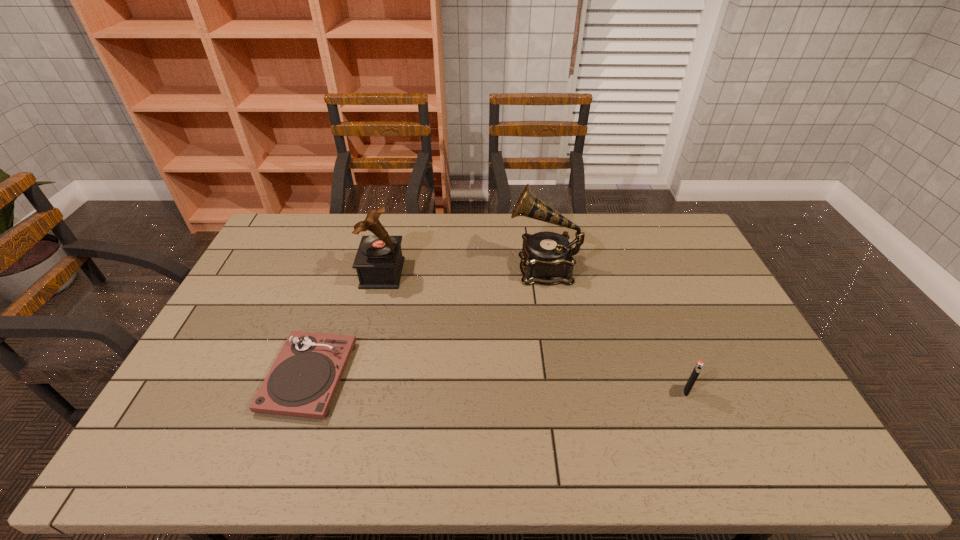
In order to click on vacant space in between the rightmost phonograph_record and the igniter in this screenshot , I will do `click(615, 329)`.

Select which object is the third closest to the third object from left to right. Please provide its 2D coordinates. Your answer should be formatted as a tuple, i.e. [(x, y)], where the tuple contains the x and y coordinates of a point satisfying the conditions above.

[(302, 382)]

Select which object appears as the second closest to the rightmost phonograph_record. Please provide its 2D coordinates. Your answer should be formatted as a tuple, i.e. [(x, y)], where the tuple contains the x and y coordinates of a point satisfying the conditions above.

[(696, 371)]

Image resolution: width=960 pixels, height=540 pixels. Find the location of `phonograph_record identified as the closest to the rightmost phonograph_record`. phonograph_record identified as the closest to the rightmost phonograph_record is located at coordinates (379, 262).

Locate which phonograph_record is the second closest to the shortest phonograph_record. Please provide its 2D coordinates. Your answer should be formatted as a tuple, i.e. [(x, y)], where the tuple contains the x and y coordinates of a point satisfying the conditions above.

[(546, 258)]

Find the location of a particular element. Image resolution: width=960 pixels, height=540 pixels. free location that satisfies the following two spatial constraints: 1. on the horn of the third object from left to right; 2. on the front side of the shortest object is located at coordinates (561, 376).

Where is `vacant space that satisfies the following two spatial constraints: 1. on the horn of the rightmost phonograph_record; 2. on the left side of the third tallest object`? The image size is (960, 540). vacant space that satisfies the following two spatial constraints: 1. on the horn of the rightmost phonograph_record; 2. on the left side of the third tallest object is located at coordinates (564, 391).

Identify the location of vacant area in the image that satisfies the following two spatial constraints: 1. on the horn of the rightmost phonograph_record; 2. on the left side of the second shortest object. (564, 391).

Image resolution: width=960 pixels, height=540 pixels. I want to click on vacant area that satisfies the following two spatial constraints: 1. on the horn of the rightmost object; 2. on the right side of the rightmost phonograph_record, so click(564, 391).

The width and height of the screenshot is (960, 540). I want to click on free space that satisfies the following two spatial constraints: 1. on the horn of the second shortest object; 2. on the left side of the second object from right to left, so click(564, 391).